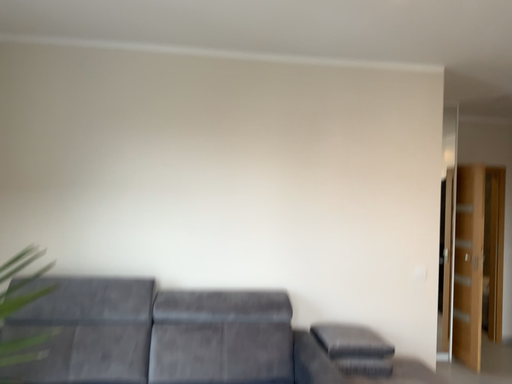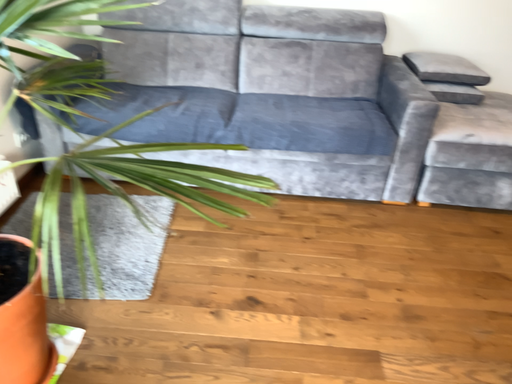
Question: Which way did the camera rotate in the video?

Choices:
 (A) rotated upward
 (B) rotated downward

Answer: (B)